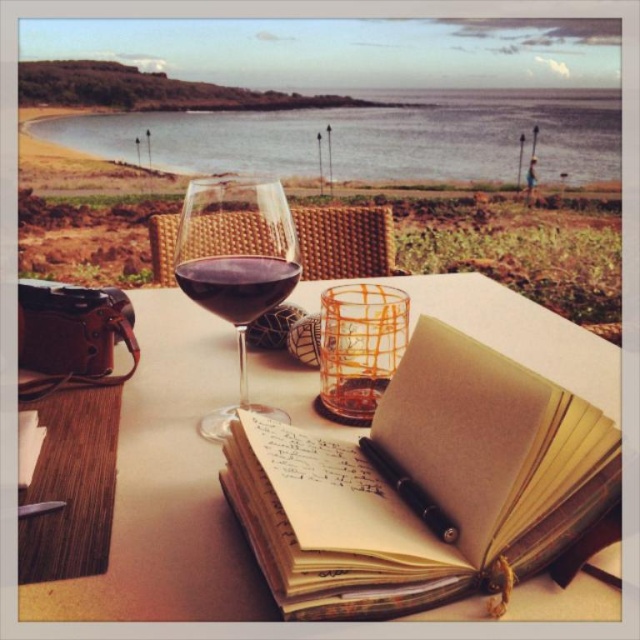
You are an artist who wants to place a new sketchbook on the table. The existing beige paper notebook at center is located at coordinates point 0.759, 0.662. If you want to place the new sketchbook to the right of the existing notebook, where should you place it?

To place the new sketchbook to the right of the beige paper notebook at center, you should position it at a coordinate with an x value greater than 0.759 and the same y value of 0.662.

You are a photographer setting up a shot of the open notebook. To ensure the black metallic pen at center is in focus, should you adjust the camera to focus closer to or further away from the clear water at upper center?

The black metallic pen at center is closer to the viewer than the clear water at upper center. To focus on the pen, adjust the camera to focus closer to the pen, moving the focus point away from the clear water at upper center.